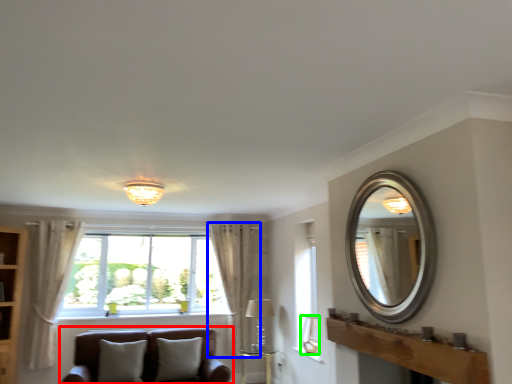
Question: Based on their relative distances, which object is nearer to studio couch (highlighted by a red box)? Choose from curtain (highlighted by a blue box) and lamp (highlighted by a green box).

Choices:
 (A) curtain
 (B) lamp

Answer: (A)